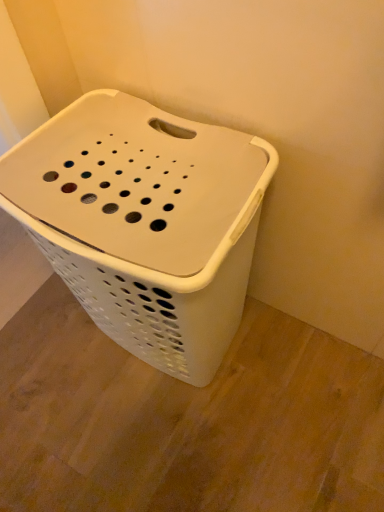
Image resolution: width=384 pixels, height=512 pixels. Describe the element at coordinates (145, 223) in the screenshot. I see `white plastic laundry basket at center` at that location.

Find the location of `white plastic laundry basket at center`. white plastic laundry basket at center is located at coordinates (145, 223).

Identify the location of white plastic laundry basket at center. This screenshot has width=384, height=512. (145, 223).